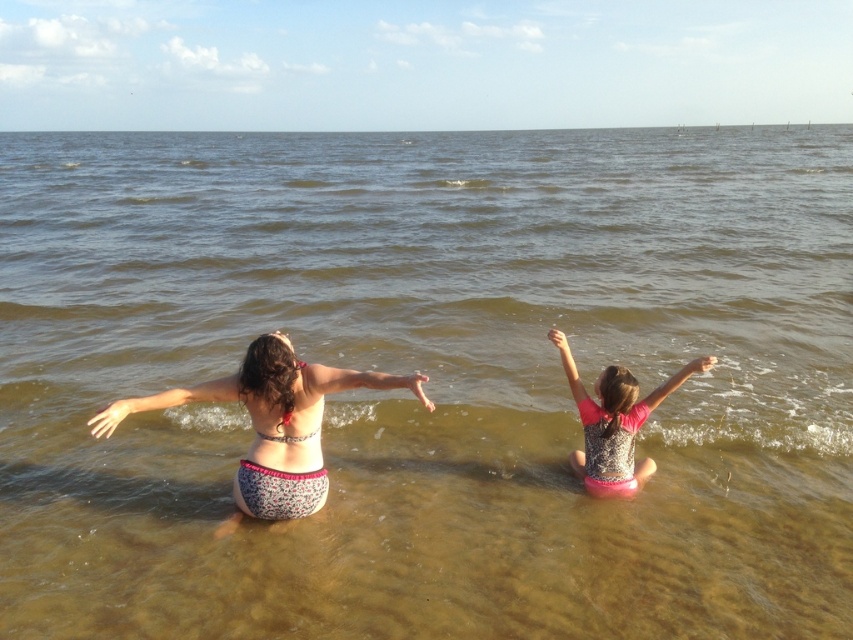
Is floral fabric bikini bottom at center to the right of pink sequined swimsuit at center from the viewer's perspective?

Incorrect, floral fabric bikini bottom at center is not on the right side of pink sequined swimsuit at center.

Is floral fabric bikini bottom at center smaller than pink sequined swimsuit at center?

Actually, floral fabric bikini bottom at center might be larger than pink sequined swimsuit at center.

Locate an element on the screen. Image resolution: width=853 pixels, height=640 pixels. floral fabric bikini bottom at center is located at coordinates (271, 420).

This screenshot has height=640, width=853. I want to click on floral fabric bikini bottom at center, so click(271, 420).